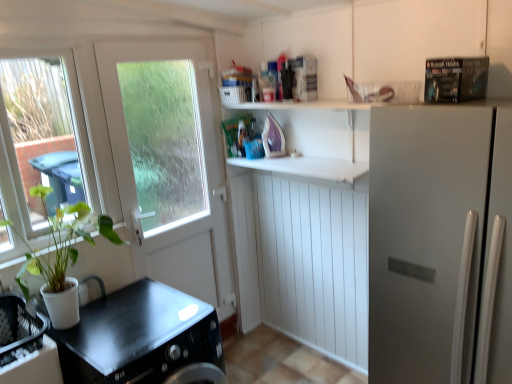
Where is `empty space that is ontop of white matte door at upper left (from a real-world perspective)`? Image resolution: width=512 pixels, height=384 pixels. empty space that is ontop of white matte door at upper left (from a real-world perspective) is located at coordinates (153, 39).